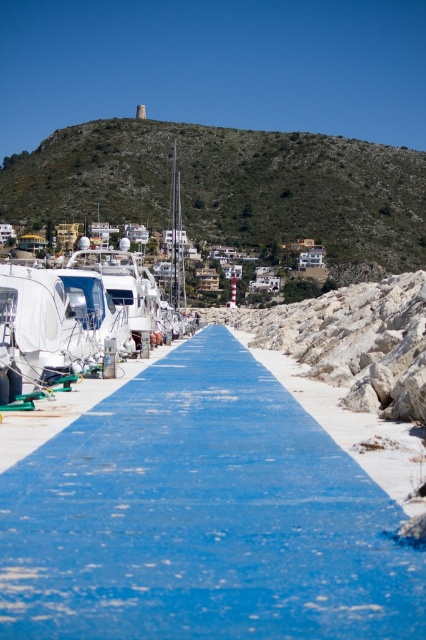
Based on the photo, can you confirm if green textured hillside at upper center is bigger than white glossy boat at left?

Correct, green textured hillside at upper center is larger in size than white glossy boat at left.

Who is positioned more to the left, green textured hillside at upper center or white glossy boat at left?

white glossy boat at left is more to the left.

Is point (268, 131) behind point (26, 292)?

Yes, it is.

The width and height of the screenshot is (426, 640). In order to click on green textured hillside at upper center in this screenshot , I will do `click(229, 186)`.

Between blue painted concrete at center and white glossy boat at left, which one is positioned lower?

Positioned lower is blue painted concrete at center.

Is point (196, 339) positioned before point (65, 387)?

No, it is behind (65, 387).

Between point (252, 371) and point (176, 296), which one is positioned behind?

The point (176, 296) is more distant.

Find the location of a particular element. blue painted concrete at center is located at coordinates (201, 518).

Between blue painted concrete at center and green textured hillside at upper center, which one is positioned higher?

green textured hillside at upper center is higher up.

Does blue painted concrete at center lie in front of green textured hillside at upper center?

Yes, blue painted concrete at center is in front of green textured hillside at upper center.

Is point (379, 541) farther from camera compared to point (245, 157)?

That is False.

Locate an element on the screen. This screenshot has height=640, width=426. blue painted concrete at center is located at coordinates (201, 518).